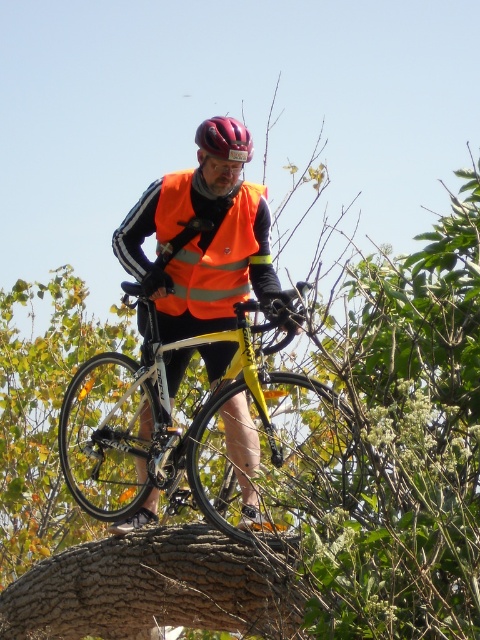
Question: Which of the following is the closest to the observer?

Choices:
 (A) (282, 374)
 (B) (235, 138)
 (C) (201, 253)

Answer: (A)

Question: Does yellow matte bicycle at center appear on the right side of orange reflective vest at center?

Choices:
 (A) yes
 (B) no

Answer: (B)

Question: Which of these objects is positioned farthest from the yellow matte bicycle at center?

Choices:
 (A) brown rough tree trunk at center
 (B) orange reflective vest at center
 (C) matte black helmet at center

Answer: (C)

Question: Can you confirm if yellow matte bicycle at center is wider than matte black helmet at center?

Choices:
 (A) yes
 (B) no

Answer: (A)

Question: Is brown rough tree trunk at center above orange reflective vest at center?

Choices:
 (A) yes
 (B) no

Answer: (B)

Question: Which point is closer to the camera?

Choices:
 (A) yellow matte bicycle at center
 (B) brown rough tree trunk at center
 (C) orange reflective vest at center
 (D) matte black helmet at center

Answer: (A)